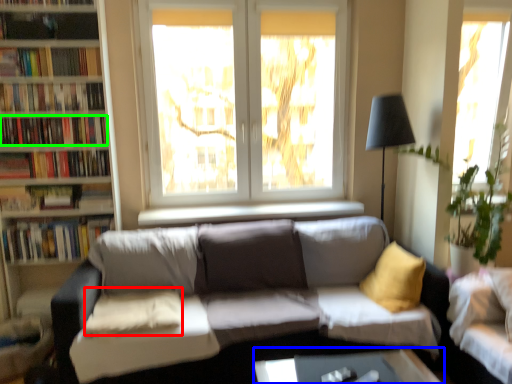
Question: Which object is positioned farthest from pillow (highlighted by a red box)? Select from table (highlighted by a blue box) and book (highlighted by a green box).

Choices:
 (A) table
 (B) book

Answer: (A)